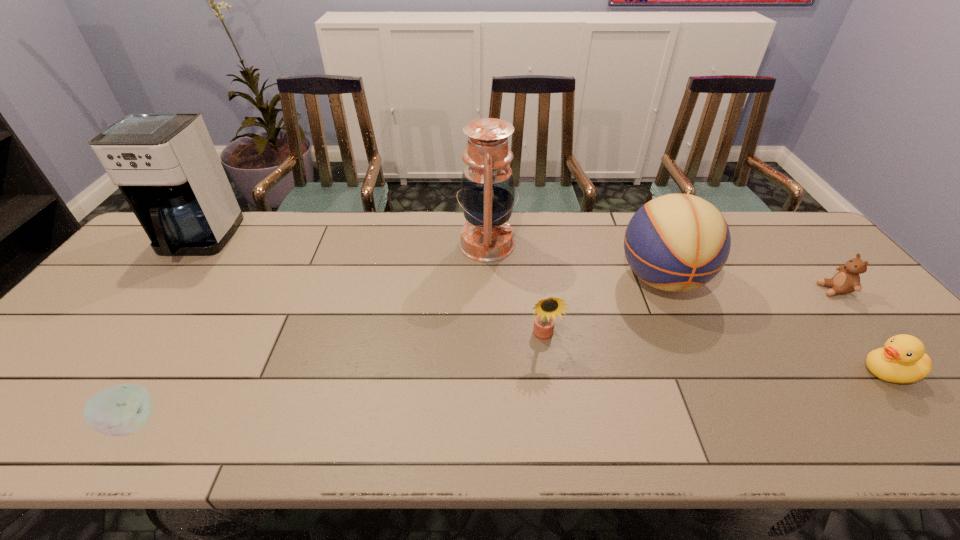
You are a GUI agent. You are given a task and a screenshot of the screen. Output one action in this format:
    pyautogui.click(x=<x>, y=<y>)
    Task: Click on the third object from left to right
    Image resolution: width=960 pixels, height=540 pixels.
    Given the screenshot: What is the action you would take?
    pyautogui.click(x=487, y=191)

You are a GUI agent. You are given a task and a screenshot of the screen. Output one action in this format:
    pyautogui.click(x=<x>, y=<y>)
    Task: Click on the leftmost object
    This screenshot has height=540, width=960.
    Given the screenshot: What is the action you would take?
    pyautogui.click(x=165, y=164)

Find the location of `the fifth shortest object`. the fifth shortest object is located at coordinates (677, 242).

This screenshot has width=960, height=540. I want to click on basketball, so click(x=677, y=242).

Image resolution: width=960 pixels, height=540 pixels. What are the coordinates of `the fourth object from left to right` in the screenshot? It's located at pos(547,309).

This screenshot has width=960, height=540. What are the coordinates of `sunflower` in the screenshot? It's located at (547, 309).

This screenshot has height=540, width=960. I want to click on teddy bear, so click(x=847, y=280).

Where is `the second nearest object`? The image size is (960, 540). the second nearest object is located at coordinates (903, 359).

You are a GUI agent. You are given a task and a screenshot of the screen. Output one action in this format:
    pyautogui.click(x=<x>, y=<y>)
    Task: Click on the second object from left to right
    This screenshot has width=960, height=540.
    Given the screenshot: What is the action you would take?
    pyautogui.click(x=122, y=410)

I want to click on the nearest object, so click(122, 410).